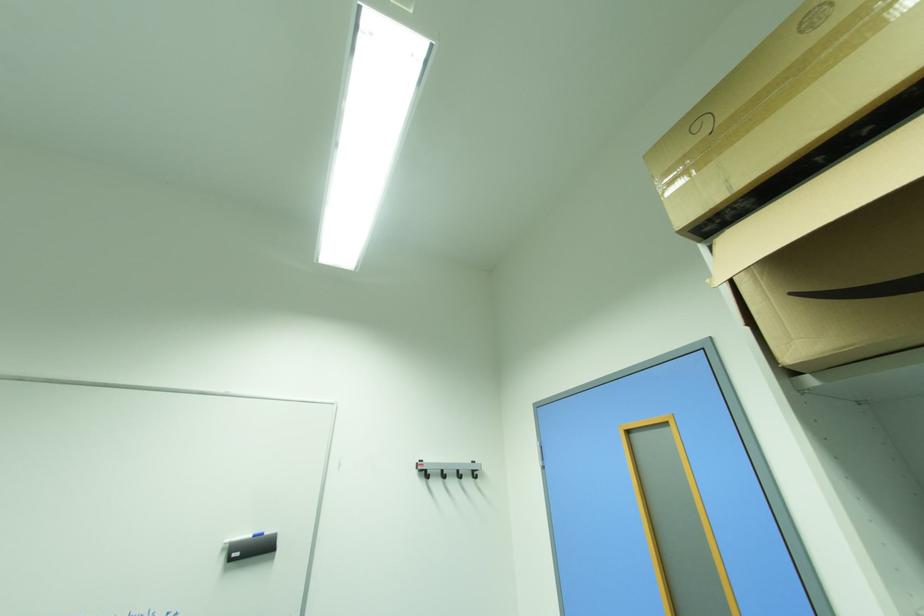
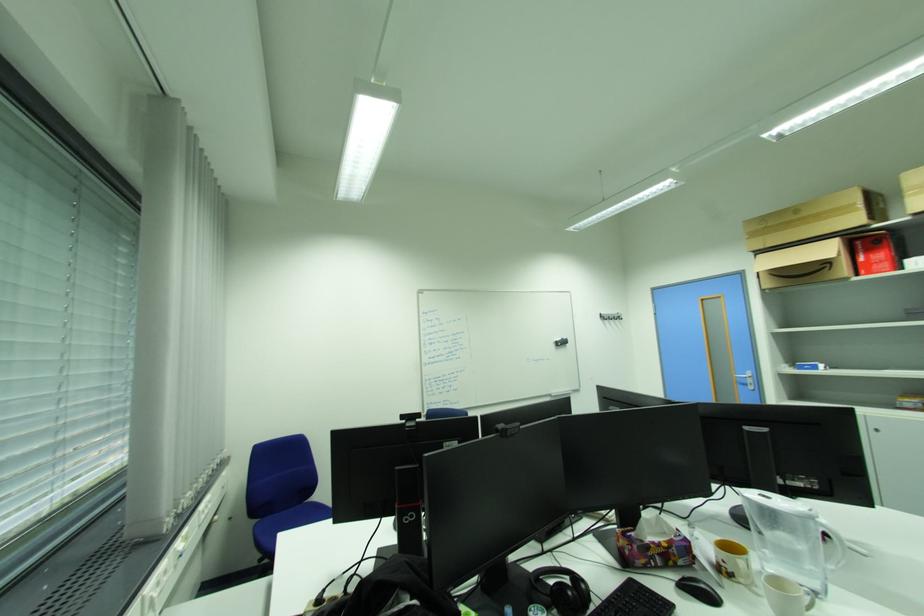
Which direction would the cameraman need to move to produce the second image?

The movement direction of the cameraman is left, backward.